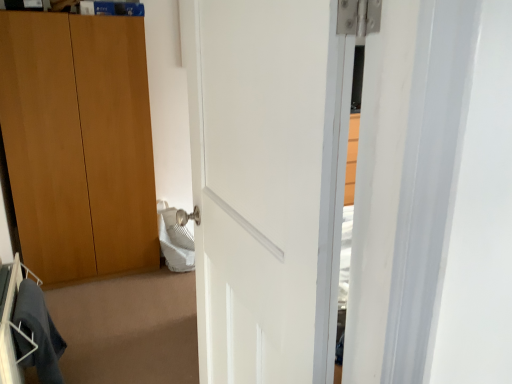
Where is `dark gray fabric at lower left`? dark gray fabric at lower left is located at coordinates (37, 334).

Describe the element at coordinates (37, 334) in the screenshot. The image size is (512, 384). I see `dark gray fabric at lower left` at that location.

Measure the distance between point (339, 150) and camera.

A distance of 63.00 centimeters exists between point (339, 150) and camera.

Identify the location of white glossy door at center. (267, 183).

This screenshot has width=512, height=384. Describe the element at coordinates (267, 183) in the screenshot. I see `white glossy door at center` at that location.

This screenshot has width=512, height=384. I want to click on dark gray fabric at lower left, so click(x=37, y=334).

Can you confirm if white glossy door at center is positioned to the right of dark gray fabric at lower left?

Yes, white glossy door at center is to the right of dark gray fabric at lower left.

Which object is further away from the camera, white glossy door at center or dark gray fabric at lower left?

Positioned behind is dark gray fabric at lower left.

Is point (277, 248) closer to viewer compared to point (30, 337)?

Yes, it is.

From the image's perspective, which object appears higher, white glossy door at center or dark gray fabric at lower left?

white glossy door at center appears higher in the image.

From a real-world perspective, relative to dark gray fabric at lower left, is white glossy door at center vertically above or below?

In terms of real-world spatial position, white glossy door at center is above dark gray fabric at lower left.

Considering the sizes of objects white glossy door at center and dark gray fabric at lower left in the image provided, who is thinner, white glossy door at center or dark gray fabric at lower left?

With smaller width is dark gray fabric at lower left.

In the scene shown: Considering the sizes of objects white glossy door at center and dark gray fabric at lower left in the image provided, who is taller, white glossy door at center or dark gray fabric at lower left?

white glossy door at center is taller.

In the scene shown: Between white glossy door at center and dark gray fabric at lower left, which one has smaller size?

dark gray fabric at lower left.

Is white glossy door at center spatially inside dark gray fabric at lower left, or outside of it?

white glossy door at center exists outside the volume of dark gray fabric at lower left.

Is the surface of white glossy door at center in direct contact with dark gray fabric at lower left?

No, white glossy door at center is not touching dark gray fabric at lower left.

Is white glossy door at center looking in the opposite direction of dark gray fabric at lower left?

No, white glossy door at center is not facing the opposite direction of dark gray fabric at lower left.

How many degrees apart are the facing directions of white glossy door at center and dark gray fabric at lower left?

91 degrees.

Find the location of `robe directly beneath the white glossy door at center (from a real-world perspective)`. robe directly beneath the white glossy door at center (from a real-world perspective) is located at coordinates (37, 334).

Would you say dark gray fabric at lower left is to the left or to the right of white glossy door at center in the picture?

dark gray fabric at lower left is positioned on white glossy door at center's left side.

Considering their positions, is dark gray fabric at lower left located in front of or behind white glossy door at center?

Clearly, dark gray fabric at lower left is behind white glossy door at center.

Which point is more distant from viewer, (25, 338) or (269, 149)?

Positioned behind is point (25, 338).

From the image's perspective, which one is positioned lower, dark gray fabric at lower left or white glossy door at center?

dark gray fabric at lower left is shown below in the image.

From a real-world perspective, which object rests below the other?

dark gray fabric at lower left.

In terms of width, does dark gray fabric at lower left look wider or thinner when compared to white glossy door at center?

In the image, dark gray fabric at lower left appears to be more narrow than white glossy door at center.

Which of these two, dark gray fabric at lower left or white glossy door at center, stands shorter?

dark gray fabric at lower left is shorter.

Does dark gray fabric at lower left have a larger size compared to white glossy door at center?

No.

Does dark gray fabric at lower left contain white glossy door at center?

No, dark gray fabric at lower left does not contain white glossy door at center.

Would you say dark gray fabric at lower left is a long distance from white glossy door at center?

Yes.

Is dark gray fabric at lower left facing away from white glossy door at center?

No, white glossy door at center is not at the back of dark gray fabric at lower left.

This screenshot has height=384, width=512. In order to click on door in front of the dark gray fabric at lower left in this screenshot , I will do `click(267, 183)`.

Identify the location of door that appears above the dark gray fabric at lower left (from the image's perspective). The width and height of the screenshot is (512, 384). (267, 183).

In order to click on robe that is under the white glossy door at center (from a real-world perspective) in this screenshot , I will do `click(37, 334)`.